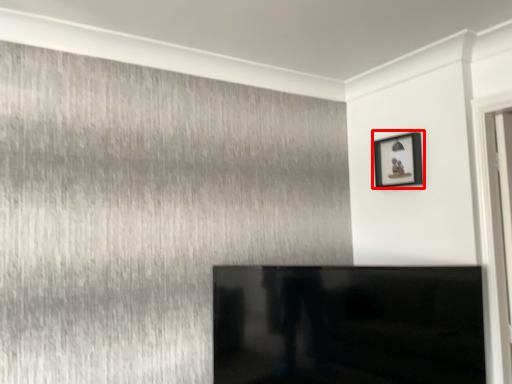
Question: In this image, where is picture frame (annotated by the red box) located relative to furniture?

Choices:
 (A) right
 (B) left

Answer: (A)